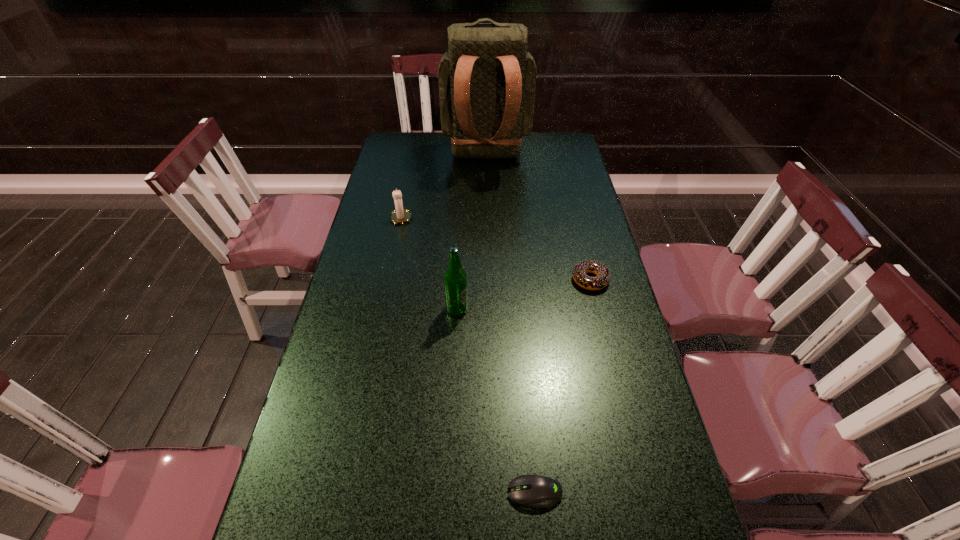
The height and width of the screenshot is (540, 960). Find the location of `vacant space that satisfies the following two spatial constraints: 1. on the front side of the third nearest object; 2. on the label of the beer bottle`. vacant space that satisfies the following two spatial constraints: 1. on the front side of the third nearest object; 2. on the label of the beer bottle is located at coordinates (597, 309).